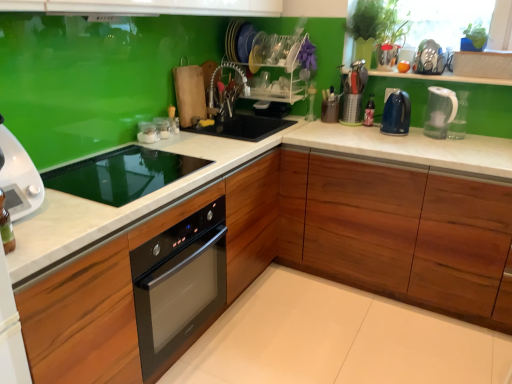
Question: Based on their positions, is clear plastic dish rack at center, the second shelf in the bottom-to-top sequence, located to the left or right of clear plastic bottle at center, which is the 1th bottle from front to back?

Choices:
 (A) right
 (B) left

Answer: (B)

Question: From the image's perspective, is clear plastic dish rack at center, which ranks as the 1th shelf in top-to-bottom order, above or below clear plastic bottle at center, acting as the second bottle starting from the back?

Choices:
 (A) below
 (B) above

Answer: (B)

Question: Estimate the real-world distances between objects in this image. Which object is farther from the transparent glass bottle at upper right, acting as the 1th bottle starting from the back?

Choices:
 (A) wooden cabinet at lower right, marked as the 2th cabinetry in a left-to-right arrangement
 (B) clear plastic dish rack at center, which ranks as the 1th shelf in top-to-bottom order
 (C) brown matte utensil holder at center, positioned as the 3th appliance in right-to-left order
 (D) clear plastic dish rack at upper center, which is the second shelf from top to bottom
 (E) clear glass jar at upper center, acting as the sixth appliance starting from the right

Answer: (E)

Question: Which object is the closest to the white marble countertop at center?

Choices:
 (A) metallic silver toaster at upper right, the 1th appliance from the right
 (B) transparent glass bottle at upper right, positioned as the first bottle in left-to-right order
 (C) clear plastic dish rack at upper center, which ranks as the 1th shelf in bottom-to-top order
 (D) clear glass jar at upper center, acting as the sixth appliance starting from the right
 (E) clear plastic dish rack at center, which ranks as the 1th shelf in top-to-bottom order

Answer: (E)